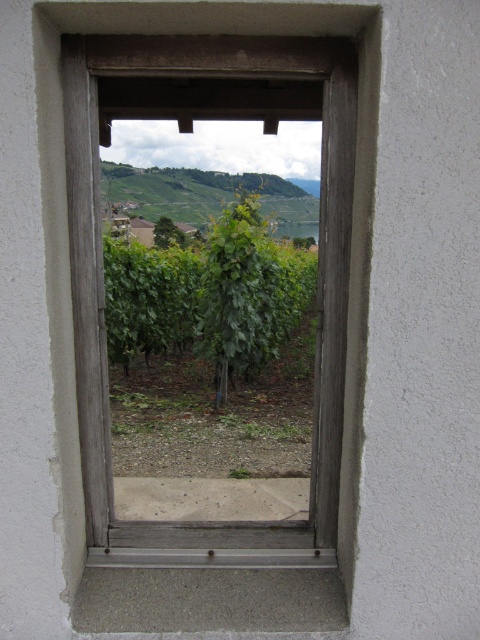
You are a painter standing 2 meters away from the wooden frame at center. You want to paint the green leafy vine at center. Can you reach it with your 3.5 meter long pole?

The distance between wooden frame at center and green leafy vine at center is 4.29 meters. Since the painter is 2 meters away from the wooden frame at center, the total distance to the green leafy vine at center is 6.29 meters. The pole is only 3.5 meters long, so the painter cannot reach the green leafy vine at center.

You are standing outside the building and looking at the window. There is a point marked at coordinates (66, 211). What does this point indicate?

The point at coordinates (66, 211) marks the wooden frame at center.